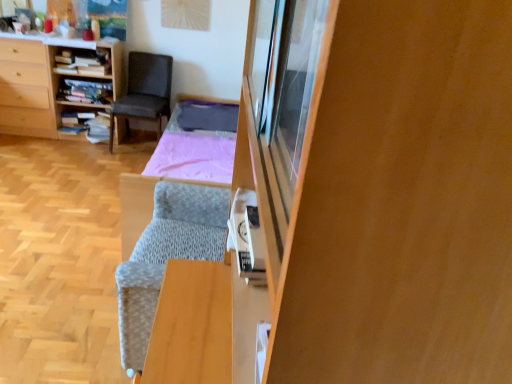
This screenshot has width=512, height=384. What do you see at coordinates (85, 123) in the screenshot?
I see `wooden bookshelf at left, acting as the 1th shelf starting from the bottom` at bounding box center [85, 123].

The width and height of the screenshot is (512, 384). Identify the location of wooden bookshelf at left, which appears as the third shelf when viewed from the top. (85, 123).

Find the location of a particular element. This screenshot has width=512, height=384. wooden bookshelf at left is located at coordinates (46, 83).

What is the approximate width of textured gray bed frame at center?

6.81 feet.

Find the location of a particular element. wooden bookshelf at center, which is counted as the second shelf, starting from the top is located at coordinates (85, 91).

Where is `dark gray fabric chair at upper left`? Image resolution: width=512 pixels, height=384 pixels. dark gray fabric chair at upper left is located at coordinates (144, 92).

Locate an element on the screen. wooden bookshelf at left, which appears as the third shelf when viewed from the top is located at coordinates (85, 123).

How distant is dark gray fabric chair at upper left from wooden bookshelf at left, which appears as the third shelf when viewed from the top?

dark gray fabric chair at upper left and wooden bookshelf at left, which appears as the third shelf when viewed from the top, are 14.28 inches apart.

Between dark gray fabric chair at upper left and wooden bookshelf at left, which appears as the third shelf when viewed from the top, which one has larger width?

dark gray fabric chair at upper left.

Starting from the dark gray fabric chair at upper left, which shelf is the 3rd one to the left? Please provide its 2D coordinates.

[(85, 123)]

Based on the photo, is dark gray fabric chair at upper left directly adjacent to wooden bookshelf at left, which appears as the third shelf when viewed from the top?

No, dark gray fabric chair at upper left is not beside wooden bookshelf at left, which appears as the third shelf when viewed from the top.

Which is behind, point (148, 176) or point (396, 45)?

The point (148, 176) is farther.

Relative to wooden cabinet at right, is textured gray bed frame at center in front or behind?

Visually, textured gray bed frame at center is located behind wooden cabinet at right.

Measure the distance between textured gray bed frame at center and wooden cabinet at right.

The distance of textured gray bed frame at center from wooden cabinet at right is 1.82 meters.

From a real-world perspective, is textured gray bed frame at center over wooden cabinet at right?

Actually, textured gray bed frame at center is physically below wooden cabinet at right in the real world.

Considering the sizes of wooden bookshelf at left and dark gray fabric chair at upper left in the image, is wooden bookshelf at left taller or shorter than dark gray fabric chair at upper left?

In the image, wooden bookshelf at left appears to be taller than dark gray fabric chair at upper left.

What are the coordinates of `chair that appears on the right of wooden bookshelf at left` in the screenshot? It's located at (144, 92).

Which is in front, wooden bookshelf at left or dark gray fabric chair at upper left?

dark gray fabric chair at upper left.

Is wooden bookshelf at center, acting as the 2th shelf starting from the bottom, oriented towards textured gray bed frame at center?

No, wooden bookshelf at center, acting as the 2th shelf starting from the bottom, is not aimed at textured gray bed frame at center.

Which of these two, wooden bookshelf at center, acting as the 2th shelf starting from the bottom, or textured gray bed frame at center, stands shorter?

wooden bookshelf at center, acting as the 2th shelf starting from the bottom, is shorter.

Is point (95, 103) closer to viewer compared to point (217, 98)?

Yes, it is.

In the scene shown: Does wooden bookshelf at center, which is counted as the second shelf, starting from the top, lie behind textured gray bed frame at center?

Yes, wooden bookshelf at center, which is counted as the second shelf, starting from the top, is further from the camera.

Is wooden bookshelf at left, which appears as the third shelf when viewed from the top, in front of wooden bookshelf at upper left, the 1th shelf from the top?

No, the depth of wooden bookshelf at left, which appears as the third shelf when viewed from the top, is greater than that of wooden bookshelf at upper left, the 1th shelf from the top.

From a real-world perspective, is wooden bookshelf at left, which appears as the third shelf when viewed from the top, positioned above or below wooden bookshelf at upper left, the 1th shelf from the top?

In terms of real-world spatial position, wooden bookshelf at left, which appears as the third shelf when viewed from the top, is below wooden bookshelf at upper left, the 1th shelf from the top.

From the picture: Considering the sizes of objects wooden bookshelf at left, acting as the 1th shelf starting from the bottom, and wooden bookshelf at upper left, the 1th shelf from the top, in the image provided, who is smaller, wooden bookshelf at left, acting as the 1th shelf starting from the bottom, or wooden bookshelf at upper left, the 1th shelf from the top,?

wooden bookshelf at upper left, the 1th shelf from the top.

Locate an element on the screen. shelf that is the 2nd object to the right of the wooden bookshelf at left, acting as the 1th shelf starting from the bottom, starting at the anchor is located at coordinates (83, 61).

The image size is (512, 384). I want to click on shelf that is the 1st object directly below the wooden cabinet at right (from a real-world perspective), so click(x=83, y=61).

Can you tell me how much wooden bookshelf at upper left, the 1th shelf from the top, and wooden cabinet at right differ in facing direction?

The angle between the facing direction of wooden bookshelf at upper left, the 1th shelf from the top, and the facing direction of wooden cabinet at right is 88.9 degrees.

From a real-world perspective, is wooden bookshelf at upper left, which is the 3th shelf in bottom-to-top order, positioned under wooden cabinet at right based on gravity?

Yes.

From the picture: Considering the sizes of objects wooden bookshelf at upper left, which is the 3th shelf in bottom-to-top order, and wooden cabinet at right in the image provided, who is bigger, wooden bookshelf at upper left, which is the 3th shelf in bottom-to-top order, or wooden cabinet at right?

Bigger between the two is wooden cabinet at right.

From the image's perspective, is wooden cabinet at right located above dark gray fabric chair at upper left?

No, from the image's perspective, wooden cabinet at right is not above dark gray fabric chair at upper left.

Considering the positions of objects wooden cabinet at right and dark gray fabric chair at upper left in the image provided, who is in front, wooden cabinet at right or dark gray fabric chair at upper left?

wooden cabinet at right.

Consider the image. Are wooden cabinet at right and dark gray fabric chair at upper left beside each other?

No.

Consider the image. Could you tell me if wooden cabinet at right is turned towards dark gray fabric chair at upper left?

No, wooden cabinet at right is not facing towards dark gray fabric chair at upper left.

This screenshot has height=384, width=512. In order to click on the 3rd shelf to the left of the dark gray fabric chair at upper left, starting your count from the anchor in this screenshot , I will do `click(85, 123)`.

Locate an element on the screen. The image size is (512, 384). cabinetry below the textured gray bed frame at center (from the image's perspective) is located at coordinates (406, 202).

Based on their spatial positions, is wooden cabinet at right or wooden bookshelf at left, which appears as the third shelf when viewed from the top, further from textured gray bed frame at center?

Based on the image, wooden cabinet at right appears to be further to textured gray bed frame at center.

Considering their positions, is wooden bookshelf at left, acting as the 1th shelf starting from the bottom, positioned closer to wooden bookshelf at center, which is counted as the second shelf, starting from the top, than wooden bookshelf at upper left, which is the 3th shelf in bottom-to-top order?

wooden bookshelf at upper left, which is the 3th shelf in bottom-to-top order, is closer to wooden bookshelf at center, which is counted as the second shelf, starting from the top.

Estimate the real-world distances between objects in this image. Which object is further from textured gray bed frame at center, wooden bookshelf at left, which appears as the third shelf when viewed from the top, or wooden bookshelf at left?

The object further to textured gray bed frame at center is wooden bookshelf at left.

Considering their positions, is wooden bookshelf at center, acting as the 2th shelf starting from the bottom, positioned closer to wooden bookshelf at upper left, which is the 3th shelf in bottom-to-top order, than textured gray bed frame at center?

wooden bookshelf at center, acting as the 2th shelf starting from the bottom, lies closer to wooden bookshelf at upper left, which is the 3th shelf in bottom-to-top order, than the other object.

Considering their positions, is wooden cabinet at right positioned closer to dark gray fabric chair at upper left than wooden bookshelf at left, which appears as the third shelf when viewed from the top?

wooden bookshelf at left, which appears as the third shelf when viewed from the top, is closer to dark gray fabric chair at upper left.

When comparing their distances from wooden bookshelf at left, does wooden bookshelf at left, which appears as the third shelf when viewed from the top, or textured gray bed frame at center seem closer?

wooden bookshelf at left, which appears as the third shelf when viewed from the top, is closer to wooden bookshelf at left.

Based on their spatial positions, is wooden bookshelf at left, which appears as the third shelf when viewed from the top, or wooden cabinet at right further from dark gray fabric chair at upper left?

Based on the image, wooden cabinet at right appears to be further to dark gray fabric chair at upper left.

When comparing their distances from textured gray bed frame at center, does dark gray fabric chair at upper left or wooden bookshelf at left, acting as the 1th shelf starting from the bottom, seem closer?

The object closer to textured gray bed frame at center is dark gray fabric chair at upper left.

You are a GUI agent. You are given a task and a screenshot of the screen. Output one action in this format:
    pyautogui.click(x=<x>, y=<y>)
    Task: Click on the bed frame between wooden cabinet at right and wooden bookshelf at center, which is counted as the second shelf, starting from the top, along the z-axis
    The height and width of the screenshot is (384, 512).
    Given the screenshot: What is the action you would take?
    pyautogui.click(x=142, y=205)

This screenshot has height=384, width=512. In order to click on bed frame positioned between wooden cabinet at right and wooden bookshelf at upper left, which is the 3th shelf in bottom-to-top order, from near to far in this screenshot , I will do `click(142, 205)`.

Find the location of `bed frame positioned between wooden cabinet at right and wooden bookshelf at left from near to far`. bed frame positioned between wooden cabinet at right and wooden bookshelf at left from near to far is located at coordinates (142, 205).

Locate an element on the screen. Image resolution: width=512 pixels, height=384 pixels. chair between wooden cabinet at right and wooden bookshelf at upper left, the 1th shelf from the top, along the z-axis is located at coordinates (144, 92).